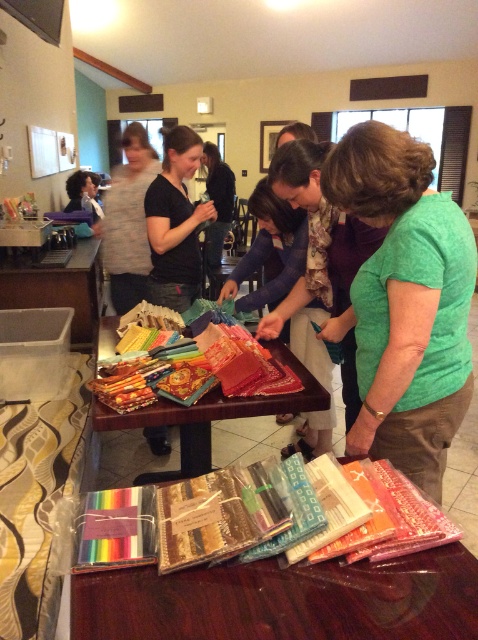
Which of these two, green cotton shirt at center or shiny plastic fabric at center, stands taller?

green cotton shirt at center

Is point (362, 269) positioned after point (90, 579)?

That is True.

The image size is (478, 640). In order to click on green cotton shirt at center in this screenshot , I will do `click(405, 301)`.

Does shiny plastic fabric at center appear over textured fabric at center?

No, shiny plastic fabric at center is not above textured fabric at center.

Measure the distance from shiny plastic fabric at center to textured fabric at center.

They are 86.44 centimeters apart.

Is point (198, 579) farther from viewer compared to point (183, 429)?

No, (198, 579) is in front of (183, 429).

Locate an element on the screen. Image resolution: width=478 pixels, height=640 pixels. shiny plastic fabric at center is located at coordinates (283, 600).

Who is positioned more to the left, green cotton shirt at center or textured fabric at center?

From the viewer's perspective, textured fabric at center appears more on the left side.

From the picture: Is green cotton shirt at center thinner than textured fabric at center?

Indeed, green cotton shirt at center has a lesser width compared to textured fabric at center.

Between point (350, 180) and point (112, 472), which one is positioned behind?

The point (112, 472) is more distant.

The width and height of the screenshot is (478, 640). Find the location of `green cotton shirt at center`. green cotton shirt at center is located at coordinates (405, 301).